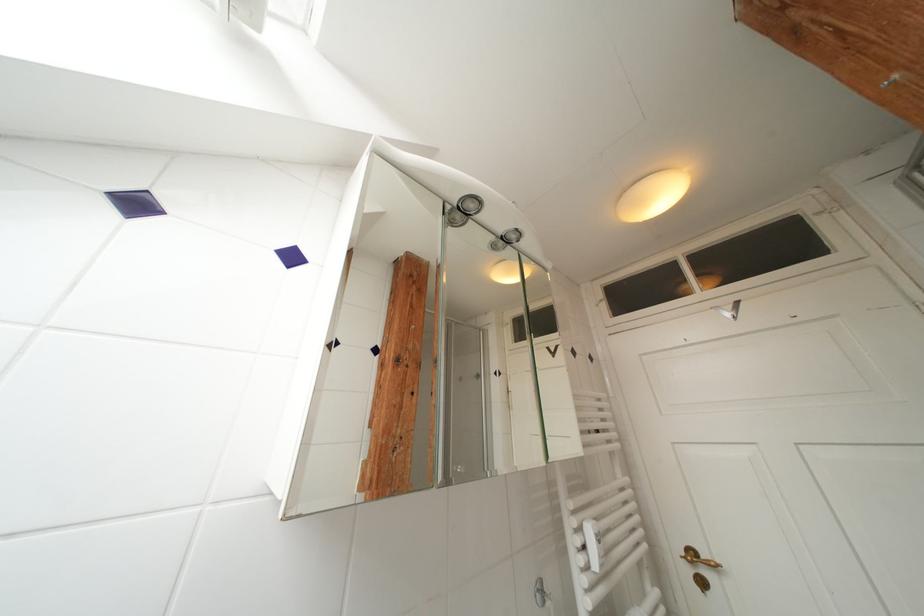
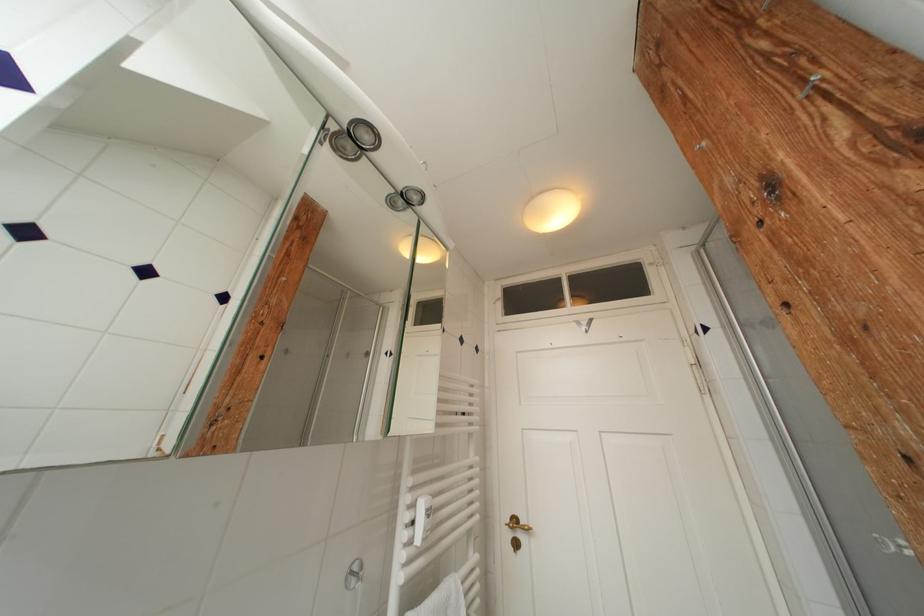
Question: How did the camera likely rotate?

Choices:
 (A) Left
 (B) Right
 (C) Up
 (D) Down

Answer: (B)